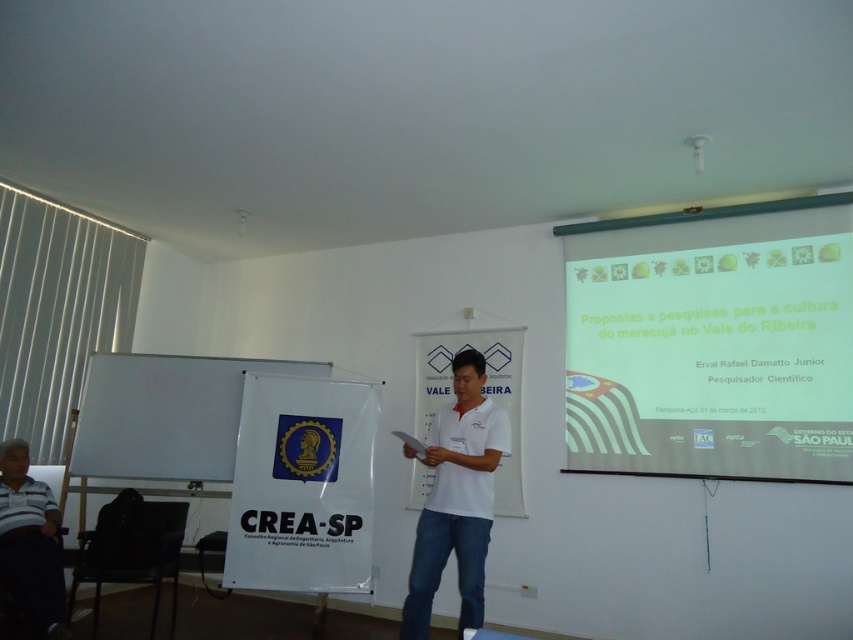
You are a photographer standing in the conference room. You need to take a photo of the white matte projector screen at upper right and the white matte shirt at center. The camera you are using has a minimum focus distance of 1.5 meters. Will you be able to focus on both objects clearly in the same photo?

The distance between the white matte projector screen at upper right and the white matte shirt at center is 1.42 meters. Since the camera requires a minimum focus distance of 1.5 meters to focus on both objects simultaneously, the 1.42 meters is shorter than the required distance. Therefore, the photographer cannot focus on both objects clearly in the same photo.